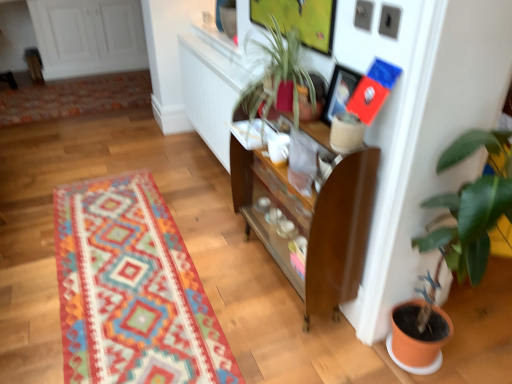
The width and height of the screenshot is (512, 384). In order to click on free space that is in between brown wood cabinet at center and multicolored woven rug at center, the 2th mat in the top-to-bottom sequence in this screenshot , I will do `click(217, 246)`.